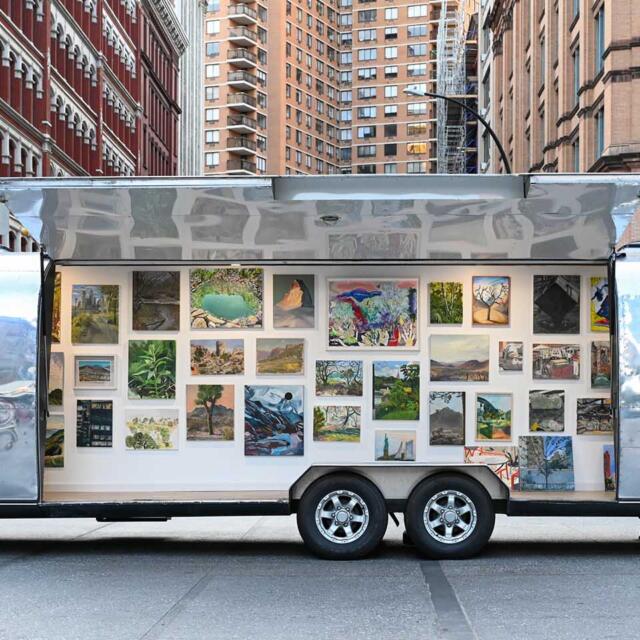
You are a GUI agent. You are given a task and a screenshot of the screen. Output one action in this format:
    pyautogui.click(x=<x>, y=<y>)
    Task: Click on the white panel
    
    Given the screenshot: What is the action you would take?
    pyautogui.click(x=155, y=474)